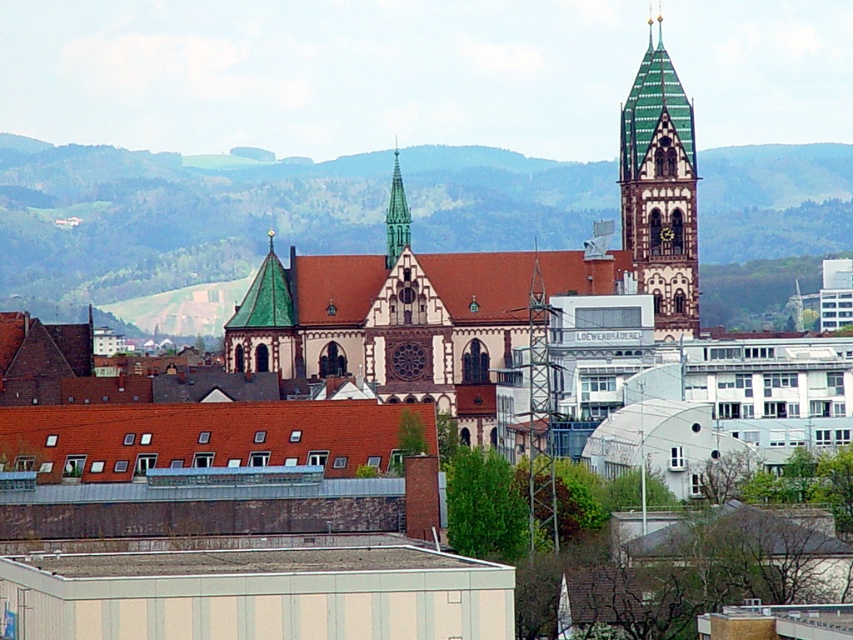
Question: Is green mosaic tower at upper center positioned behind green glass spire at center?

Choices:
 (A) yes
 (B) no

Answer: (A)

Question: Among these objects, which one is farthest from the camera?

Choices:
 (A) dark brown wooden clock at center
 (B) green mosaic tower at upper center
 (C) green glass spire at center

Answer: (A)

Question: Is green glass spire at center smaller than dark brown wooden clock at center?

Choices:
 (A) yes
 (B) no

Answer: (B)

Question: Which is farther from the dark brown wooden clock at center?

Choices:
 (A) green glass spire at center
 (B) green mosaic tower at upper center

Answer: (A)

Question: Which of the following is the closest to the observer?

Choices:
 (A) dark brown wooden clock at center
 (B) green mosaic tower at upper center
 (C) green glass spire at center

Answer: (C)

Question: Is green mosaic tower at upper center smaller than green glass spire at center?

Choices:
 (A) no
 (B) yes

Answer: (A)